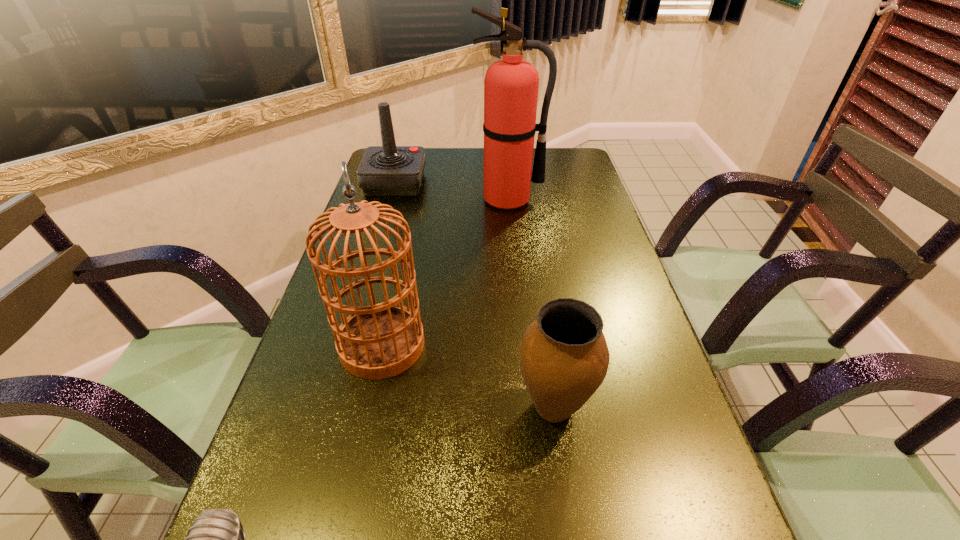
Identify the location of the tallest object. (511, 85).

Find the location of `the fourth shortest object`. the fourth shortest object is located at coordinates (379, 341).

This screenshot has height=540, width=960. I want to click on joystick, so click(388, 170).

Locate an element on the screen. urn is located at coordinates (564, 357).

Identify the location of free space located 0.110m at the nozzle of the tallest object. The image size is (960, 540). (512, 233).

Identify the location of free space located 0.120m on the front of the fourth shortest object. This screenshot has height=540, width=960. (362, 437).

At what (x,y) coordinates should I click in order to perform the action: click on free space located on the front-facing side of the joystick. Please return your answer as a coordinate pair (x, y). Image resolution: width=960 pixels, height=540 pixels. Looking at the image, I should click on (469, 183).

Identify the location of vacant area situated 0.120m on the left of the urn. This screenshot has height=540, width=960. (450, 407).

Image resolution: width=960 pixels, height=540 pixels. I want to click on object located in the far edge section of the desktop, so click(x=388, y=170).

You are a GUI agent. You are given a task and a screenshot of the screen. Output one action in this format:
    pyautogui.click(x=<x>, y=<y>)
    Task: Click on the birdcage present at the left edge
    
    Given the screenshot: What is the action you would take?
    pyautogui.click(x=379, y=341)